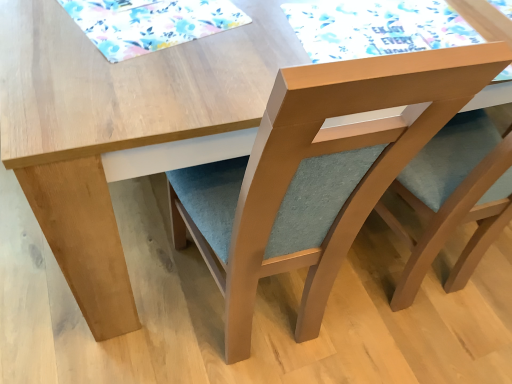
Where is `matte wood chair at center`? This screenshot has height=384, width=512. matte wood chair at center is located at coordinates (317, 173).

Locate an element on the screen. The image size is (512, 384). watercolor paper placemat at upper center, the second mat from the left is located at coordinates (376, 27).

Locate an element on the screen. The height and width of the screenshot is (384, 512). matte wood chair at center is located at coordinates (317, 173).

Is matte wood chair at center smaller than watercolor paper placemat at upper center, which is counted as the first mat, starting from the right?

No.

Does matte wood chair at center turn towards watercolor paper placemat at upper center, which is counted as the first mat, starting from the right?

No, matte wood chair at center is not oriented towards watercolor paper placemat at upper center, which is counted as the first mat, starting from the right.

Where is `chair below the watercolor paper placemat at upper center, the second mat from the left (from the image's perspective)`? The image size is (512, 384). chair below the watercolor paper placemat at upper center, the second mat from the left (from the image's perspective) is located at coordinates (317, 173).

Can you see matte wood chair at center touching watercolor paper placemat at upper center, which is counted as the first mat, starting from the right?

No, matte wood chair at center is not next to watercolor paper placemat at upper center, which is counted as the first mat, starting from the right.

From a real-world perspective, is floral fabric placemat at upper left, which is the second mat from right to left, physically below matte wood chair at center?

No, from a real-world perspective, floral fabric placemat at upper left, which is the second mat from right to left, is not beneath matte wood chair at center.

Between point (93, 25) and point (336, 263), which one is positioned behind?

The point (336, 263) is more distant.

Consider the image. From the image's perspective, does floral fabric placemat at upper left, which is the second mat from right to left, appear lower than matte wood chair at center?

Actually, floral fabric placemat at upper left, which is the second mat from right to left, appears above matte wood chair at center in the image.

Would you say floral fabric placemat at upper left, acting as the 1th mat starting from the left, is outside matte wood chair at center?

Absolutely, floral fabric placemat at upper left, acting as the 1th mat starting from the left, is external to matte wood chair at center.

Is watercolor paper placemat at upper center, which is counted as the first mat, starting from the right, oriented towards floral fabric placemat at upper left, acting as the 1th mat starting from the left?

No, watercolor paper placemat at upper center, which is counted as the first mat, starting from the right, is not turned towards floral fabric placemat at upper left, acting as the 1th mat starting from the left.

From the image's perspective, which one is positioned lower, watercolor paper placemat at upper center, the second mat from the left, or floral fabric placemat at upper left, acting as the 1th mat starting from the left?

From the image's view, watercolor paper placemat at upper center, the second mat from the left, is below.

Is watercolor paper placemat at upper center, the second mat from the left, not near floral fabric placemat at upper left, which is the second mat from right to left?

Actually, watercolor paper placemat at upper center, the second mat from the left, and floral fabric placemat at upper left, which is the second mat from right to left, are a little close together.

Find the location of `mat in front of the watercolor paper placemat at upper center, the second mat from the left`. mat in front of the watercolor paper placemat at upper center, the second mat from the left is located at coordinates (150, 23).

From the image's perspective, is floral fabric placemat at upper left, which is the second mat from right to left, on watercolor paper placemat at upper center, the second mat from the left?

Correct, floral fabric placemat at upper left, which is the second mat from right to left, appears higher than watercolor paper placemat at upper center, the second mat from the left, in the image.

Could you measure the distance between floral fabric placemat at upper left, acting as the 1th mat starting from the left, and watercolor paper placemat at upper center, the second mat from the left?

12.00 inches.

Is floral fabric placemat at upper left, which is the second mat from right to left, with watercolor paper placemat at upper center, which is counted as the first mat, starting from the right?

No, floral fabric placemat at upper left, which is the second mat from right to left, is not touching watercolor paper placemat at upper center, which is counted as the first mat, starting from the right.

Which is in front, point (200, 15) or point (448, 29)?

The point (200, 15) is in front.

Based on the photo, is watercolor paper placemat at upper center, which is counted as the first mat, starting from the right, further to the viewer compared to matte wood chair at center?

That is True.

Is watercolor paper placemat at upper center, which is counted as the first mat, starting from the right, inside or outside of matte wood chair at center?

watercolor paper placemat at upper center, which is counted as the first mat, starting from the right, exists outside the volume of matte wood chair at center.

Considering the sizes of watercolor paper placemat at upper center, which is counted as the first mat, starting from the right, and matte wood chair at center in the image, is watercolor paper placemat at upper center, which is counted as the first mat, starting from the right, taller or shorter than matte wood chair at center?

In the image, watercolor paper placemat at upper center, which is counted as the first mat, starting from the right, appears to be shorter than matte wood chair at center.

Does watercolor paper placemat at upper center, which is counted as the first mat, starting from the right, have a larger size compared to matte wood chair at center?

Actually, watercolor paper placemat at upper center, which is counted as the first mat, starting from the right, might be smaller than matte wood chair at center.

Is point (217, 202) farther from viewer compared to point (116, 18)?

Yes.

Considering the positions of objects matte wood chair at center and floral fabric placemat at upper left, acting as the 1th mat starting from the left, in the image provided, who is more to the right, matte wood chair at center or floral fabric placemat at upper left, acting as the 1th mat starting from the left,?

From the viewer's perspective, matte wood chair at center appears more on the right side.

Find the location of a particular element. This screenshot has width=512, height=384. chair in front of the floral fabric placemat at upper left, acting as the 1th mat starting from the left is located at coordinates (317, 173).

From a real-world perspective, is matte wood chair at center on floral fabric placemat at upper left, acting as the 1th mat starting from the left?

Incorrect, from a real-world perspective, matte wood chair at center is lower than floral fabric placemat at upper left, acting as the 1th mat starting from the left.

What are the coordinates of `the 2nd mat behind the matte wood chair at center, counting from the anchor's position` in the screenshot? It's located at (376, 27).

Where is `chair in front of the floral fabric placemat at upper left, which is the second mat from right to left`? This screenshot has width=512, height=384. chair in front of the floral fabric placemat at upper left, which is the second mat from right to left is located at coordinates coord(317,173).

Estimate the real-world distances between objects in this image. Which object is closer to matte wood chair at center, floral fabric placemat at upper left, acting as the 1th mat starting from the left, or watercolor paper placemat at upper center, which is counted as the first mat, starting from the right?

watercolor paper placemat at upper center, which is counted as the first mat, starting from the right.

Based on their spatial positions, is watercolor paper placemat at upper center, which is counted as the first mat, starting from the right, or matte wood chair at center further from floral fabric placemat at upper left, acting as the 1th mat starting from the left?

matte wood chair at center lies further to floral fabric placemat at upper left, acting as the 1th mat starting from the left, than the other object.

Estimate the real-world distances between objects in this image. Which object is further from watercolor paper placemat at upper center, the second mat from the left, floral fabric placemat at upper left, which is the second mat from right to left, or matte wood chair at center?

matte wood chair at center.

Considering their positions, is matte wood chair at center positioned further to watercolor paper placemat at upper center, the second mat from the left, than floral fabric placemat at upper left, acting as the 1th mat starting from the left?

Among the two, matte wood chair at center is located further to watercolor paper placemat at upper center, the second mat from the left.

Based on their spatial positions, is matte wood chair at center or watercolor paper placemat at upper center, which is counted as the first mat, starting from the right, closer to floral fabric placemat at upper left, which is the second mat from right to left?

watercolor paper placemat at upper center, which is counted as the first mat, starting from the right, lies closer to floral fabric placemat at upper left, which is the second mat from right to left, than the other object.

Based on their spatial positions, is watercolor paper placemat at upper center, which is counted as the first mat, starting from the right, or floral fabric placemat at upper left, which is the second mat from right to left, closer to matte wood chair at center?

watercolor paper placemat at upper center, which is counted as the first mat, starting from the right, is positioned closer to the anchor matte wood chair at center.

This screenshot has height=384, width=512. Find the location of `chair between floral fabric placemat at upper left, which is the second mat from right to left, and watercolor paper placemat at upper center, the second mat from the left`. chair between floral fabric placemat at upper left, which is the second mat from right to left, and watercolor paper placemat at upper center, the second mat from the left is located at coordinates (317, 173).